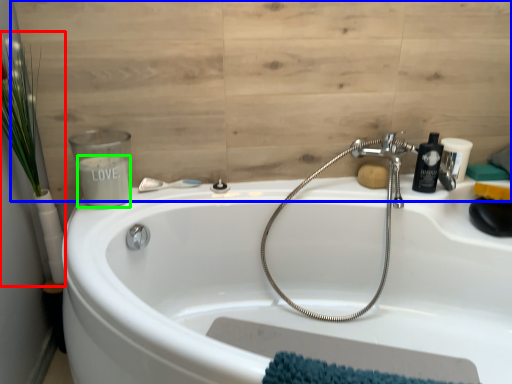
Question: Which is farther away from plant (highlighted by a red box)? plywood (highlighted by a blue box) or liquid (highlighted by a green box)?

Choices:
 (A) plywood
 (B) liquid

Answer: (A)